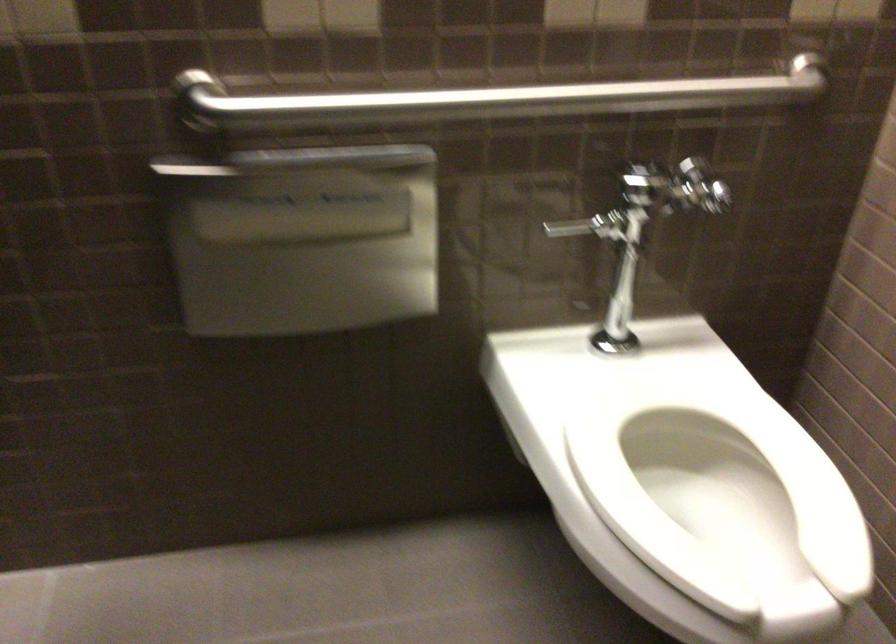
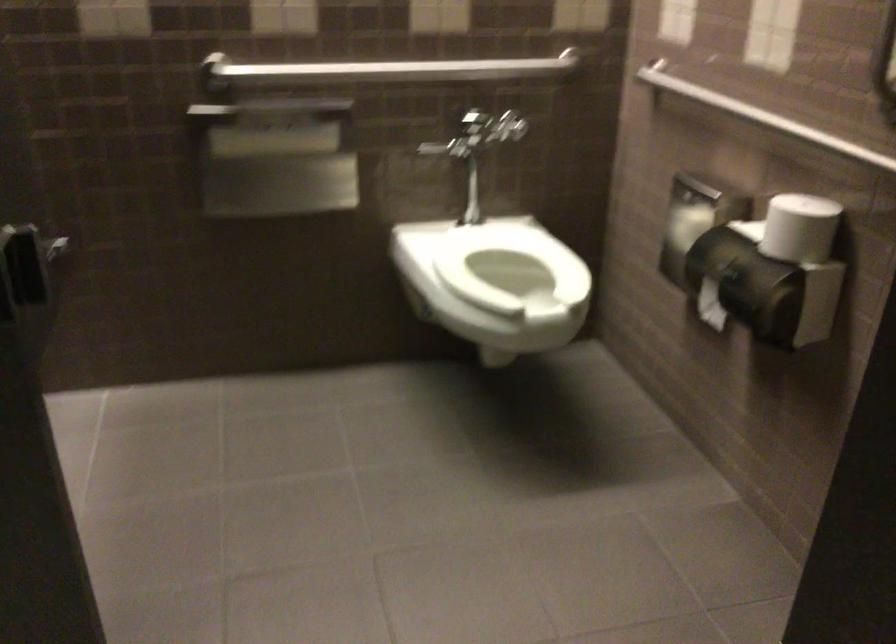
The point at (683,427) is marked in the first image. Where is the corresponding point in the second image?

(509, 263)